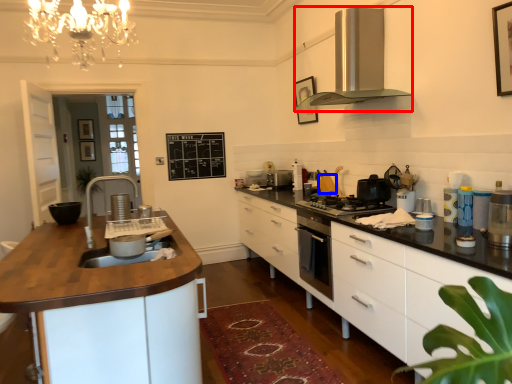
Question: Which object is further to the camera taking this photo, home appliance (highlighted by a red box) or appliance (highlighted by a blue box)?

Choices:
 (A) home appliance
 (B) appliance

Answer: (B)